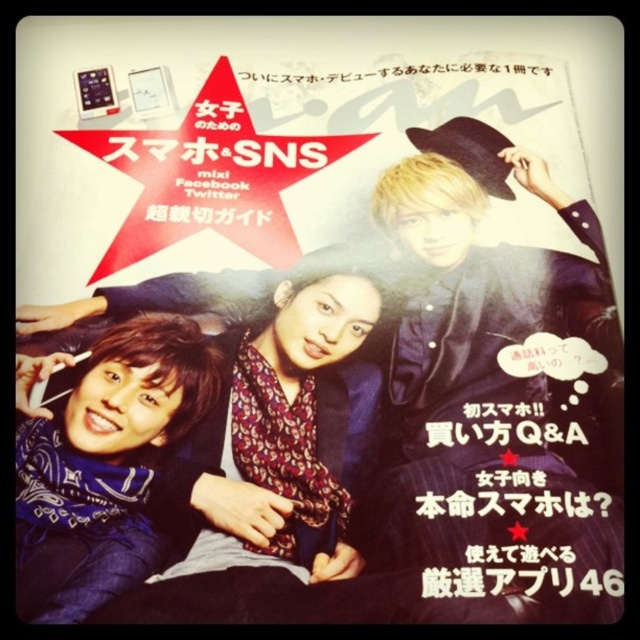
You are designing a layout for a magazine cover and need to ensure that the blue bandana at lower left and the blacktextured paperposter at upper center are visible. Which object should be placed higher in the image to ensure visibility?

The blue bandana at lower left should be placed higher since it is taller than the blacktextured paperposter at upper center, ensuring it doesn not get cut off or obscured.